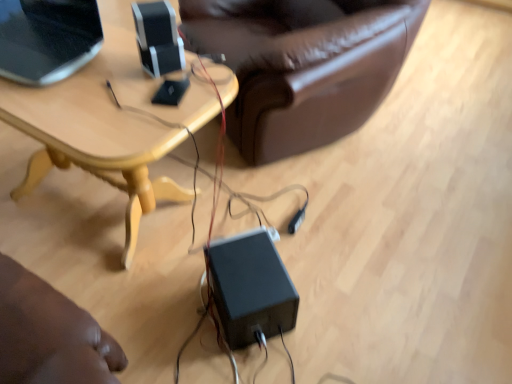
The image size is (512, 384). In order to click on free location in front of matte black laptop at upper left in this screenshot , I will do `click(56, 110)`.